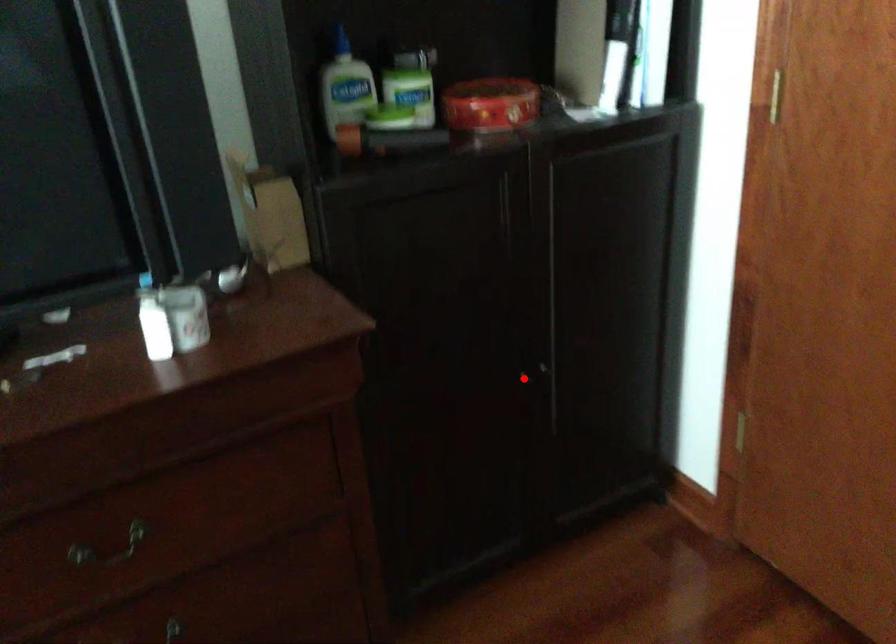
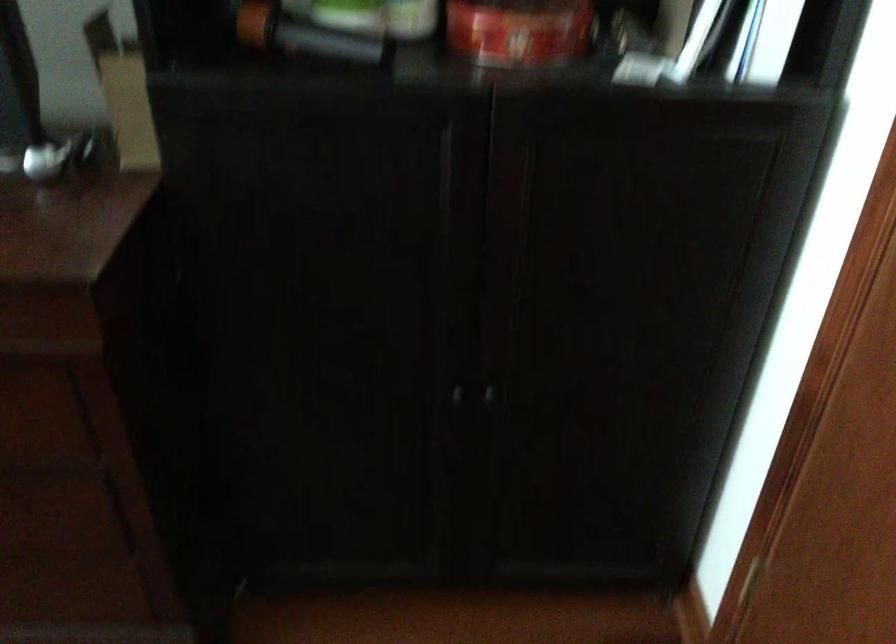
Question: I am providing you with two images of the same scene from different viewpoints. Image1 has a red point marked. In image2, the corresponding 3D location appears at what relative position? Reply with the corresponding letter.

Choices:
 (A) Closer
 (B) Farther

Answer: (A)